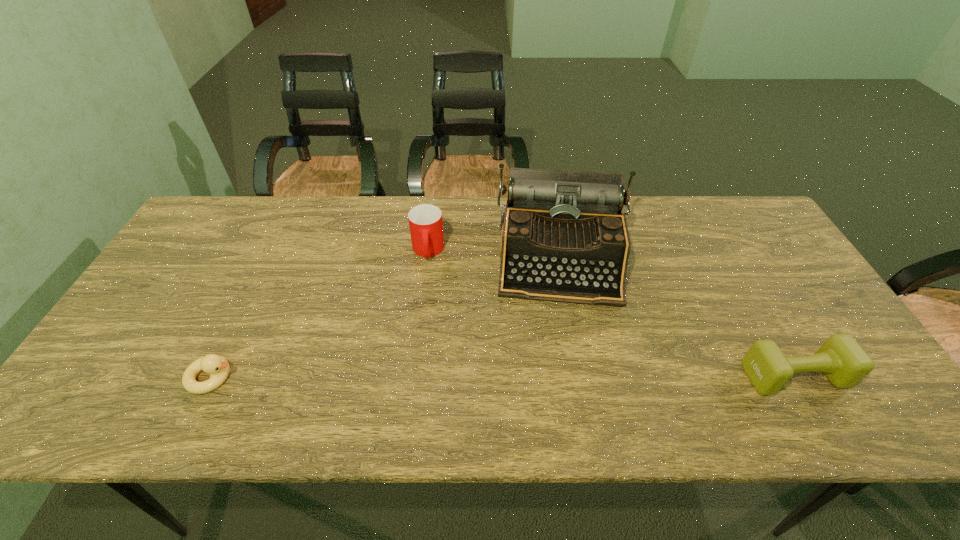
In order to click on object that is at the right edge in this screenshot , I will do `click(843, 361)`.

What are the coordinates of `object that is at the near right corner` in the screenshot? It's located at (843, 361).

Where is `free space at the far edge of the desktop`? This screenshot has height=540, width=960. free space at the far edge of the desktop is located at coordinates (473, 202).

The image size is (960, 540). Find the location of `vacant space at the near edge of the desktop`. vacant space at the near edge of the desktop is located at coordinates (540, 368).

In order to click on vacant region at the left edge of the desktop in this screenshot , I will do `click(143, 338)`.

In the image, there is a desktop. Find the location of `blank space at the far left corner`. blank space at the far left corner is located at coordinates point(213,238).

Find the location of a particular element. The height and width of the screenshot is (540, 960). vacant area at the far right corner of the desktop is located at coordinates (736, 242).

Image resolution: width=960 pixels, height=540 pixels. Find the location of `blank space at the near right corner of the desktop`. blank space at the near right corner of the desktop is located at coordinates (852, 392).

Identify the location of vacant space in between the third object from right to left and the rightmost object. (611, 313).

The height and width of the screenshot is (540, 960). Identify the location of vacant space that's between the duckling and the third shortest object. (320, 314).